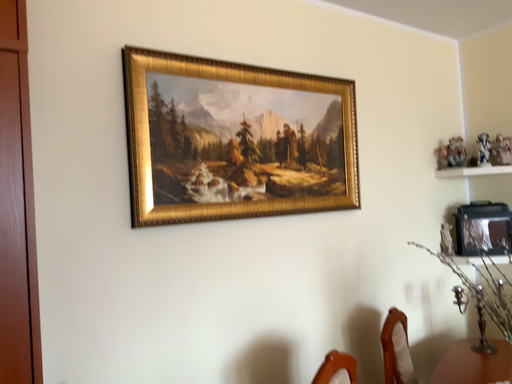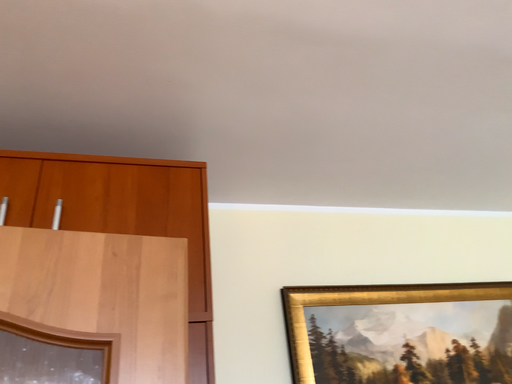
Question: How did the camera likely rotate when shooting the video?

Choices:
 (A) rotated downward
 (B) rotated upward

Answer: (B)